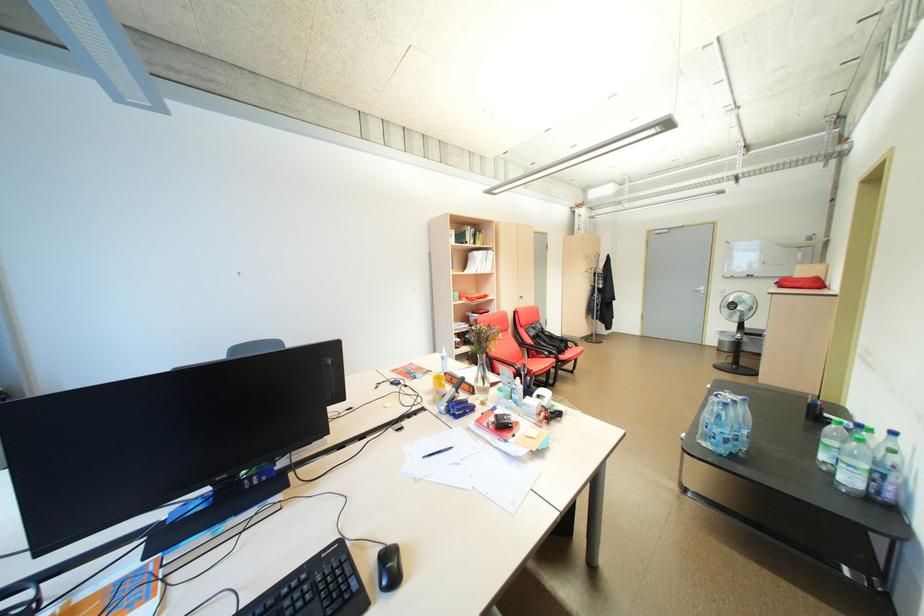
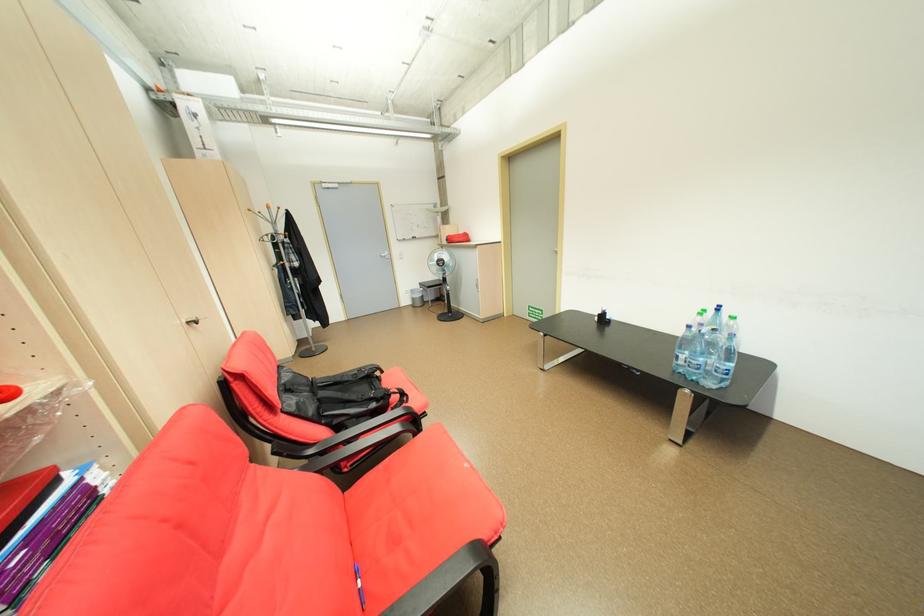
Where in the second image is the point corresponding to [721,341] from the first image?

(415, 302)